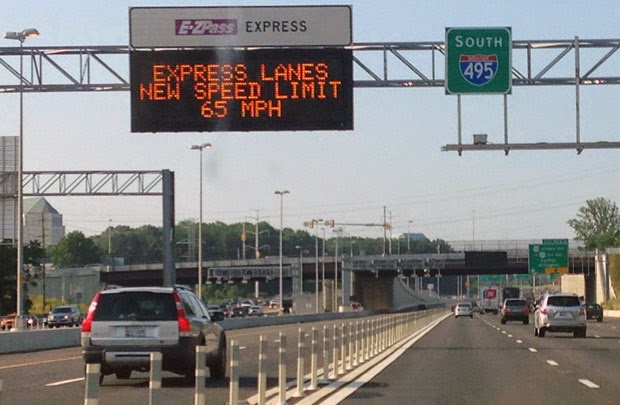
Find the location of a particular element. window is located at coordinates (131, 297).